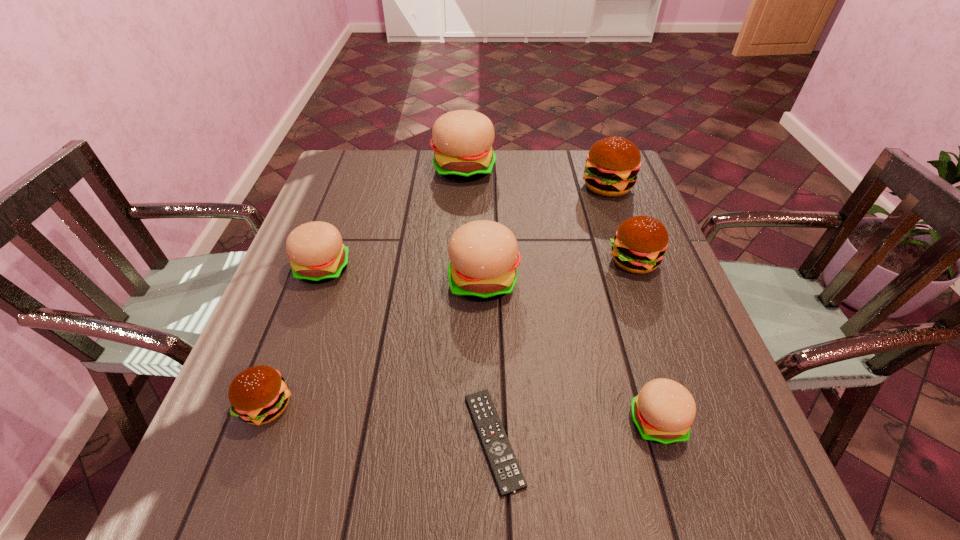
Where is `the farthest beige hamburger`? The image size is (960, 540). the farthest beige hamburger is located at coordinates (462, 140).

Identify the location of the biggest brown hamburger. (612, 164).

Image resolution: width=960 pixels, height=540 pixels. I want to click on the third smallest beige hamburger, so click(484, 256).

Image resolution: width=960 pixels, height=540 pixels. Identify the location of the second nearest brown hamburger. (639, 245).

Where is `the leftmost beige hamburger`? The image size is (960, 540). the leftmost beige hamburger is located at coordinates (317, 254).

Locate an element on the screen. the smallest brown hamburger is located at coordinates (258, 395).

You are a GUI agent. You are given a task and a screenshot of the screen. Output one action in this format:
    pyautogui.click(x=<x>, y=<y>)
    Task: Click on the nearest brown hamburger
    The height and width of the screenshot is (540, 960).
    Given the screenshot: What is the action you would take?
    pyautogui.click(x=258, y=395)

You are a GUI agent. You are given a task and a screenshot of the screen. Output one action in this format:
    pyautogui.click(x=<x>, y=<y>)
    Task: Click on the nearest beige hamburger
    Image resolution: width=960 pixels, height=540 pixels.
    Given the screenshot: What is the action you would take?
    pyautogui.click(x=663, y=411)

You are a GUI agent. You are given a task and a screenshot of the screen. Output one action in this format:
    pyautogui.click(x=<x>, y=<y>)
    Task: Click on the smallest beige hamburger
    
    Given the screenshot: What is the action you would take?
    pyautogui.click(x=663, y=411)

You are a GUI agent. You are given a task and a screenshot of the screen. Output one action in this format:
    pyautogui.click(x=<x>, y=<y>)
    Task: Click on the remote control
    This screenshot has width=960, height=540.
    Given the screenshot: What is the action you would take?
    (508, 476)